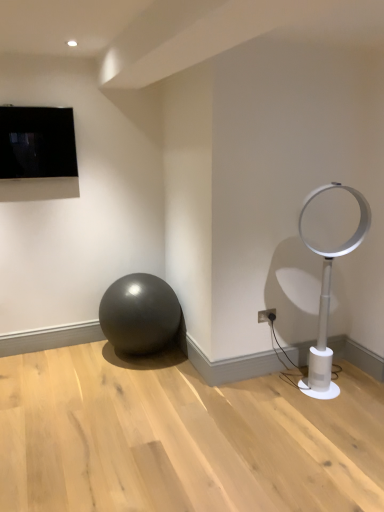
Question: Considering their positions, is black glossy tv at upper left located in front of or behind white plastic fan at right?

Choices:
 (A) behind
 (B) front

Answer: (A)

Question: Is point (14, 168) closer or farther from the camera than point (314, 396)?

Choices:
 (A) closer
 (B) farther

Answer: (B)

Question: Estimate the real-world distances between objects in this image. Which object is closer to the glossy metallic ball at lower left?

Choices:
 (A) white plastic fan at right
 (B) white plastic electric outlet at lower right
 (C) black glossy tv at upper left

Answer: (B)

Question: Which is farther from the black glossy tv at upper left?

Choices:
 (A) white plastic fan at right
 (B) glossy metallic ball at lower left
 (C) white plastic electric outlet at lower right

Answer: (C)